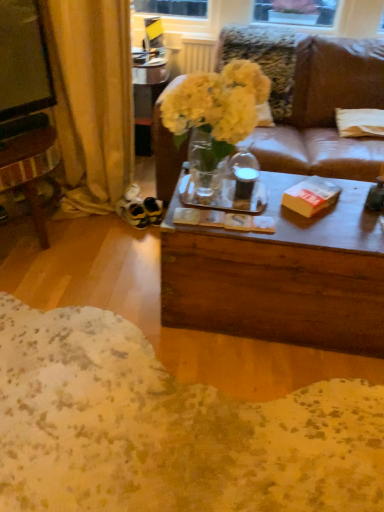
Question: Is white fabric pillow at right in front of translucent glass vase at center?

Choices:
 (A) yes
 (B) no

Answer: (B)

Question: Are white fabric pillow at right and translucent glass vase at center beside each other?

Choices:
 (A) yes
 (B) no

Answer: (B)

Question: Is white fabric pillow at right at the left side of translucent glass vase at center?

Choices:
 (A) no
 (B) yes

Answer: (A)

Question: Can you confirm if white fabric pillow at right is smaller than translucent glass vase at center?

Choices:
 (A) yes
 (B) no

Answer: (A)

Question: From the image's perspective, is white fabric pillow at right over translucent glass vase at center?

Choices:
 (A) yes
 (B) no

Answer: (B)

Question: Is point (130, 132) positioned closer to the camera than point (238, 135)?

Choices:
 (A) farther
 (B) closer

Answer: (A)

Question: From the image's perspective, is gold fabric curtain at left above or below translucent glass vase at center?

Choices:
 (A) above
 (B) below

Answer: (B)

Question: Looking at their shapes, would you say gold fabric curtain at left is wider or thinner than translucent glass vase at center?

Choices:
 (A) wide
 (B) thin

Answer: (A)

Question: Would you say gold fabric curtain at left is to the left or to the right of translucent glass vase at center in the picture?

Choices:
 (A) left
 (B) right

Answer: (A)

Question: Considering the positions of translucent glass vase at center and yellow paper book at center in the image, is translucent glass vase at center bigger or smaller than yellow paper book at center?

Choices:
 (A) big
 (B) small

Answer: (A)

Question: In terms of height, does translucent glass vase at center look taller or shorter compared to yellow paper book at center?

Choices:
 (A) short
 (B) tall

Answer: (B)

Question: Considering the relative positions of translucent glass vase at center and yellow paper book at center in the image provided, is translucent glass vase at center to the left or to the right of yellow paper book at center?

Choices:
 (A) right
 (B) left

Answer: (B)

Question: Do you think translucent glass vase at center is within yellow paper book at center, or outside of it?

Choices:
 (A) outside
 (B) inside

Answer: (A)

Question: Is yellow paper book at center inside the boundaries of gold fabric curtain at left, or outside?

Choices:
 (A) inside
 (B) outside

Answer: (B)

Question: From the image's perspective, relative to gold fabric curtain at left, is yellow paper book at center above or below?

Choices:
 (A) above
 (B) below

Answer: (B)